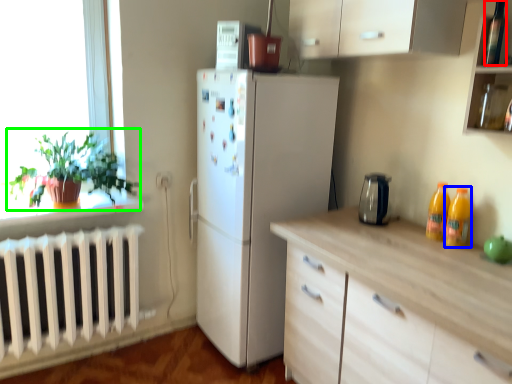
Question: Which is nearer to the bottle (highlighted by a red box)? bottle (highlighted by a blue box) or houseplant (highlighted by a green box).

Choices:
 (A) bottle
 (B) houseplant

Answer: (A)